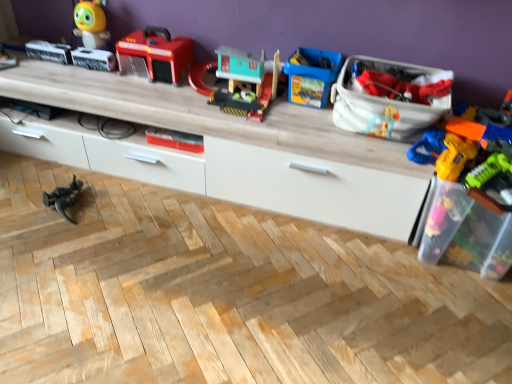
The height and width of the screenshot is (384, 512). I want to click on free area in between matte plastic fire truck at upper center, which is the 5th toy from right to left, and matte plastic toy house at center, which is the 3th toy in right-to-left order, so click(x=156, y=89).